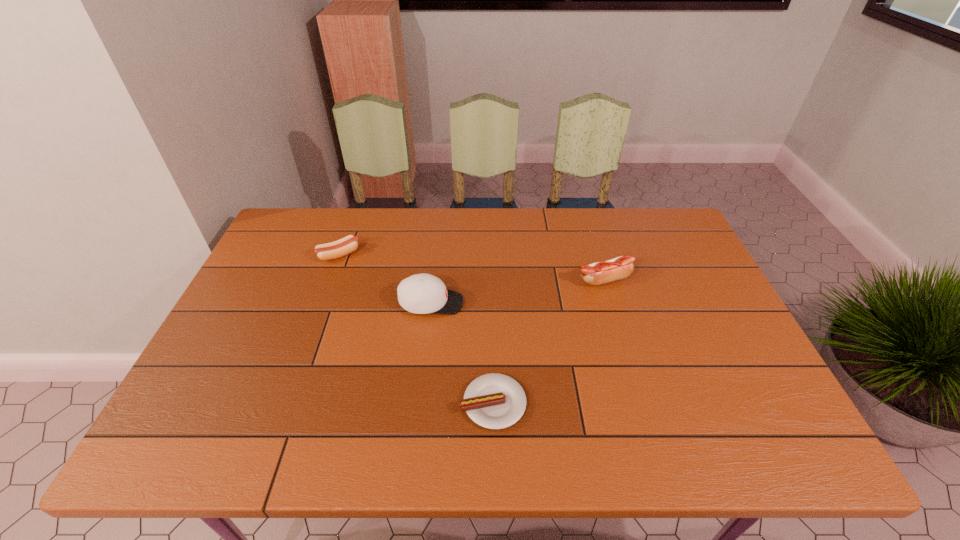
You are a GUI agent. You are given a task and a screenshot of the screen. Output one action in this format:
    pyautogui.click(x=<x>, y=<y>)
    Task: Click on the baseball cap
    Image resolution: width=960 pixels, height=540 pixels.
    Given the screenshot: What is the action you would take?
    pyautogui.click(x=423, y=293)

This screenshot has height=540, width=960. I want to click on the rightmost sausage, so click(x=621, y=267).

Locate an element on the screen. the rightmost object is located at coordinates (621, 267).

This screenshot has width=960, height=540. I want to click on the second tallest sausage, so coord(348,244).

Where is `the farthest sausage`? This screenshot has height=540, width=960. the farthest sausage is located at coordinates (348, 244).

Find the location of a particular element. the nearest sausage is located at coordinates (495, 401).

Locate an element on the screen. This screenshot has width=960, height=540. the nearest object is located at coordinates (495, 401).

Where is `vacant area situated on the front-facing side of the baseball cap`? vacant area situated on the front-facing side of the baseball cap is located at coordinates (599, 303).

Where is `free region located on the front of the second farthest sausage`? Image resolution: width=960 pixels, height=540 pixels. free region located on the front of the second farthest sausage is located at coordinates (619, 331).

Locate an element on the screen. This screenshot has width=960, height=540. vacant region located on the right of the farthest sausage is located at coordinates (474, 255).